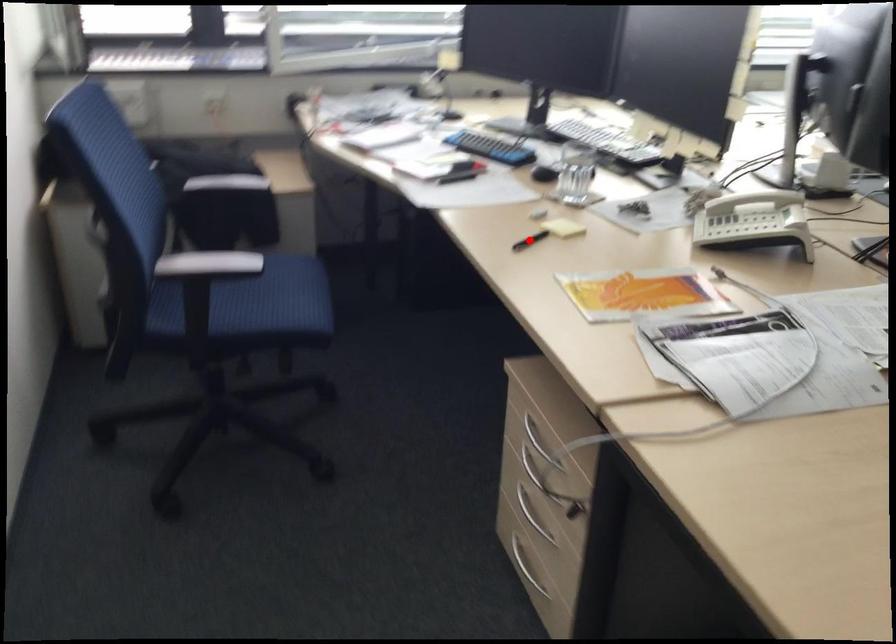
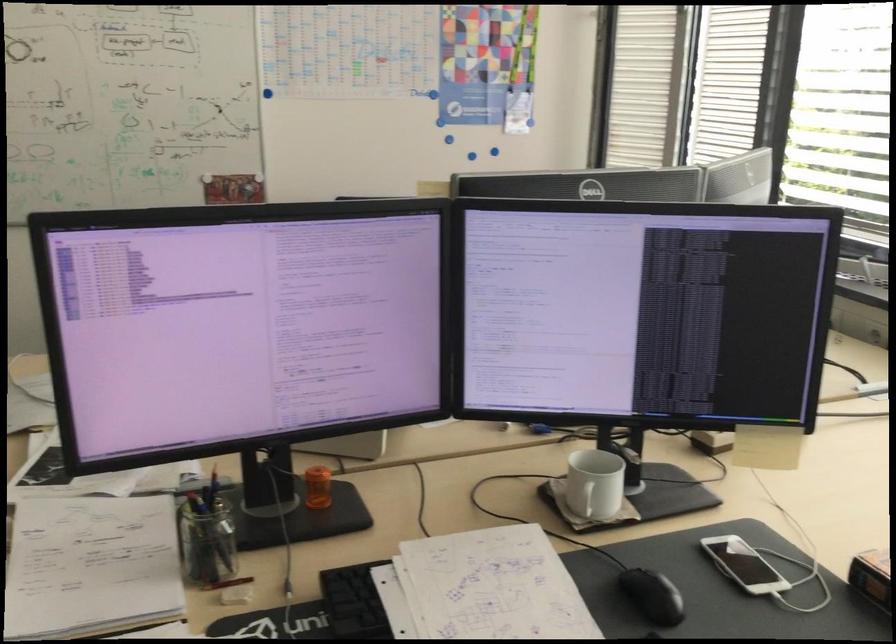
Question: I am providing you with two images of the same scene from different viewpoints. A red point is marked on the first image. At the location where the point appears in image 1, is it still visible in image 2?

Choices:
 (A) Yes
 (B) No

Answer: (B)